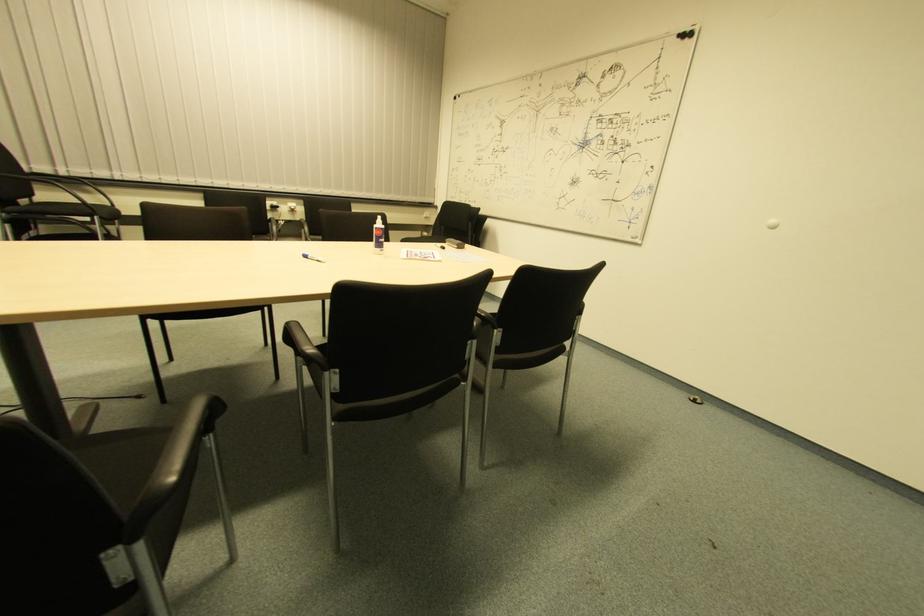
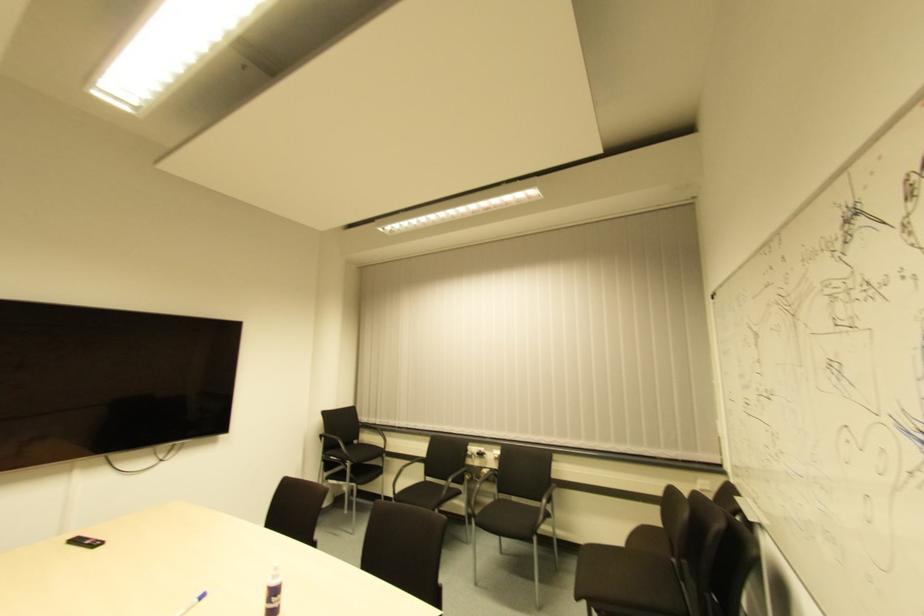
Locate, in the second image, the point that corresponds to pixel 305 261 in the first image.

(202, 600)